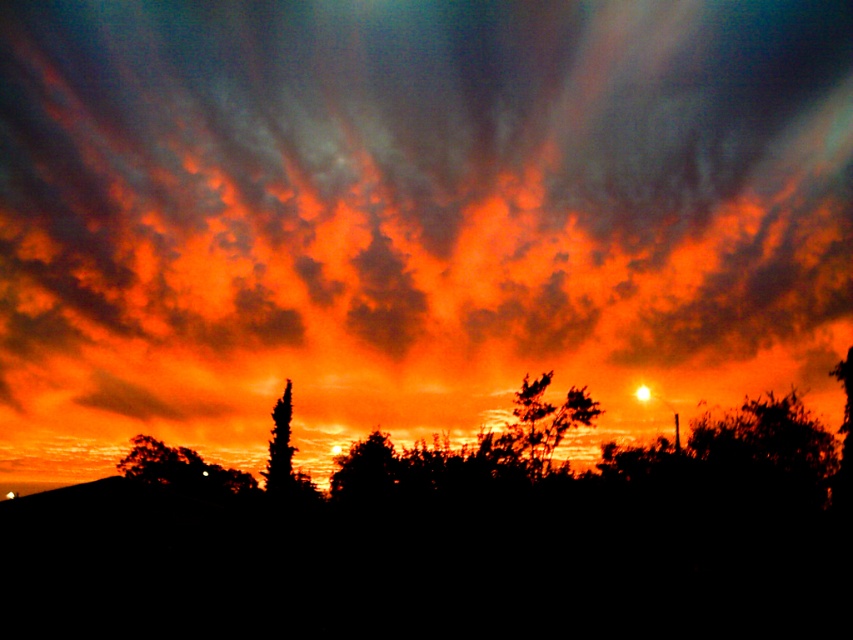
Is orange matte cloud at upper center wider than silhouette tree at center?

Indeed, orange matte cloud at upper center has a greater width compared to silhouette tree at center.

Between orange matte cloud at upper center and silhouette tree at center, which one appears on the left side from the viewer's perspective?

silhouette tree at center

Which is behind, point (354, 426) or point (351, 499)?

Point (354, 426)

Locate an element on the screen. The height and width of the screenshot is (640, 853). orange matte cloud at upper center is located at coordinates (410, 214).

Is orange matte cloud at upper center taller than silhouette leafy tree at center?

Correct, orange matte cloud at upper center is much taller as silhouette leafy tree at center.

Measure the distance between orange matte cloud at upper center and camera.

orange matte cloud at upper center and camera are 98.72 feet apart.

Is point (308, 16) less distant than point (537, 432)?

No, it is not.

Find the location of a particular element. The height and width of the screenshot is (640, 853). orange matte cloud at upper center is located at coordinates (410, 214).

Is point (532, 454) behind point (347, 502)?

No, (532, 454) is closer to viewer.

I want to click on silhouette leafy tree at center, so click(x=543, y=422).